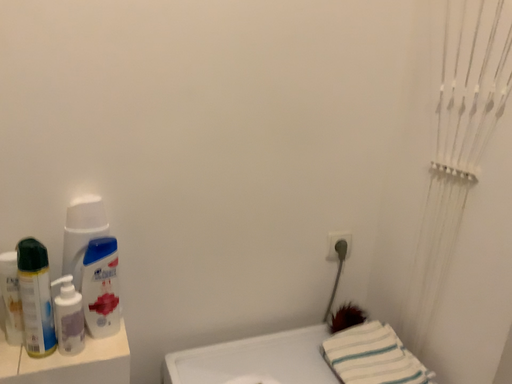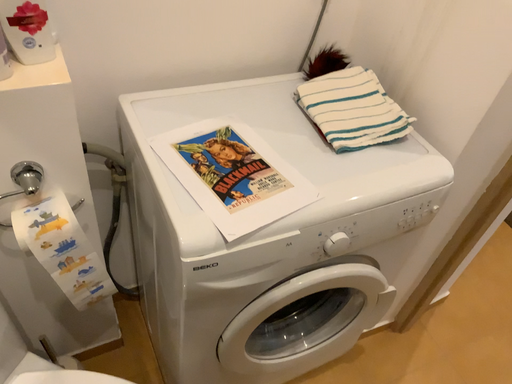
Question: How did the camera likely rotate when shooting the video?

Choices:
 (A) rotated downward
 (B) rotated upward

Answer: (A)